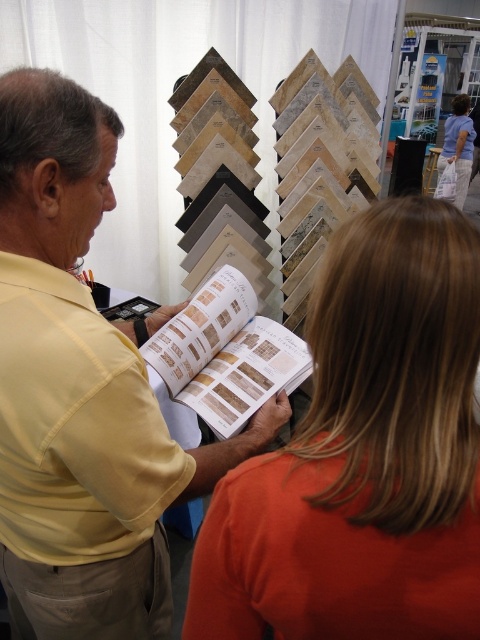
Question: Which object is the farthest from the wooden book at center?

Choices:
 (A) orange fabric shirt at upper right
 (B) yellow matte shirt at center
 (C) orange matte shirt at center

Answer: (A)

Question: Among these objects, which one is nearest to the camera?

Choices:
 (A) wooden book at center
 (B) orange fabric shirt at upper right
 (C) orange matte shirt at center

Answer: (C)

Question: Does yellow matte shirt at center appear over orange fabric shirt at upper right?

Choices:
 (A) no
 (B) yes

Answer: (A)

Question: Which object appears closest to the camera in this image?

Choices:
 (A) wooden book at center
 (B) orange matte shirt at center

Answer: (B)

Question: Does orange matte shirt at center have a larger size compared to wooden book at center?

Choices:
 (A) no
 (B) yes

Answer: (A)

Question: Can you confirm if yellow matte shirt at center is smaller than wooden book at center?

Choices:
 (A) yes
 (B) no

Answer: (B)